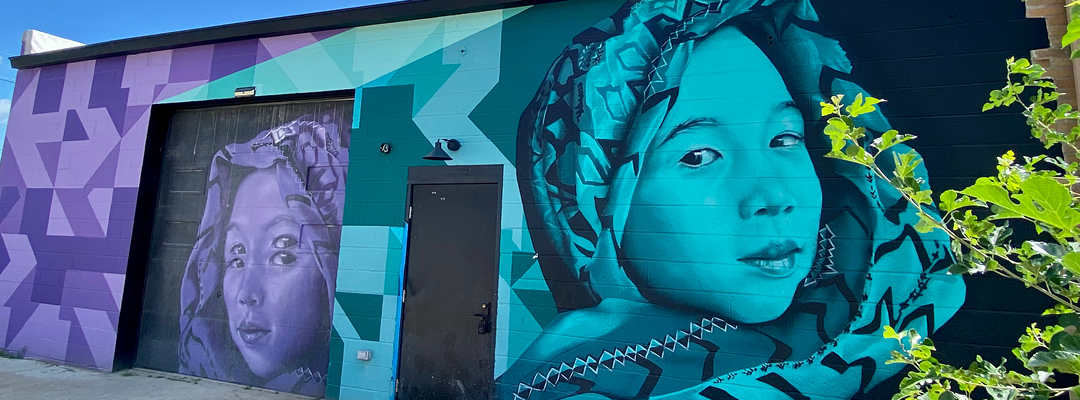
This screenshot has height=400, width=1080. I want to click on doorknob, so click(x=482, y=315).